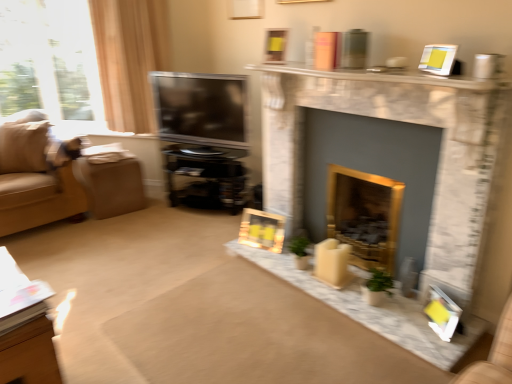
You are a GUI agent. You are given a task and a screenshot of the screen. Output one action in this format:
    pyautogui.click(x=<x>, y=<y>)
    Task: Click on the vacant space in front of matte white picture frame at lower right, the first picture frame positioned from the right
    
    Given the screenshot: What is the action you would take?
    pyautogui.click(x=446, y=344)